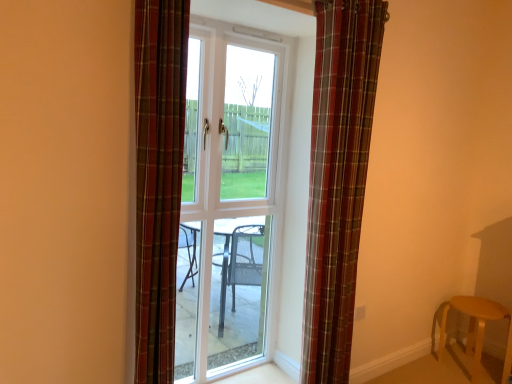
Question: From a real-world perspective, is white glass door at center physically located above or below wooden stool at lower right?

Choices:
 (A) above
 (B) below

Answer: (A)

Question: Considering the positions of white glass door at center and wooden stool at lower right in the image, is white glass door at center bigger or smaller than wooden stool at lower right?

Choices:
 (A) small
 (B) big

Answer: (B)

Question: Estimate the real-world distances between objects in this image. Which object is farther from the white glass door at center?

Choices:
 (A) plaid fabric curtain at center, marked as the 2th curtain in a back-to-front arrangement
 (B) wooden stool at lower right
 (C) plaid fabric curtain at center, which appears as the first curtain when viewed from the right

Answer: (B)

Question: Estimate the real-world distances between objects in this image. Which object is farther from the plaid fabric curtain at center, marked as the 2th curtain in a back-to-front arrangement?

Choices:
 (A) white glass door at center
 (B) wooden stool at lower right
 (C) plaid fabric curtain at center, positioned as the 1th curtain in back-to-front order

Answer: (B)